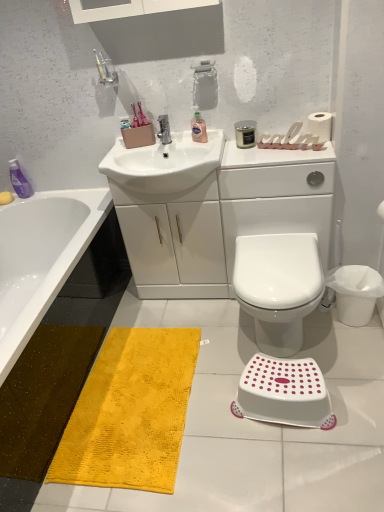
The width and height of the screenshot is (384, 512). What are the coordinates of `vacant space that is to the left of white plastic step stool at lower right` in the screenshot? It's located at (220, 435).